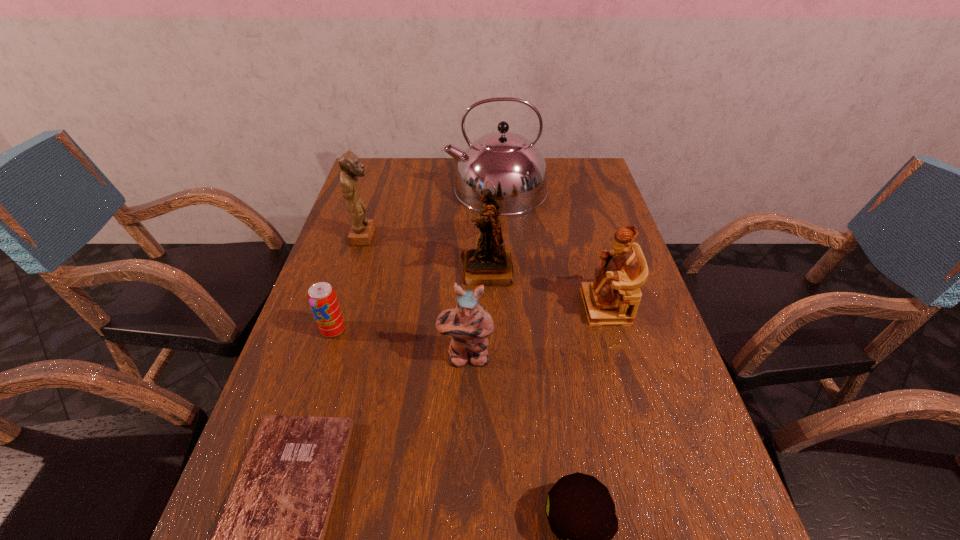
In the image, there is a desktop. Where is `vacant space at the left edge`? vacant space at the left edge is located at coordinates (353, 379).

Where is `vacant area at the right edge`? The width and height of the screenshot is (960, 540). vacant area at the right edge is located at coordinates (577, 212).

In the image, there is a desktop. At what (x,y) coordinates should I click in order to perform the action: click on vacant space at the far left corner. Please return your answer as a coordinate pair (x, y). Looking at the image, I should click on (378, 164).

The width and height of the screenshot is (960, 540). In the image, there is a desktop. Identify the location of vacant area at the far right corner. (607, 187).

Find the location of a particular element. vacant region between the third nearest object and the farthest figurine is located at coordinates (416, 297).

Find the location of a particular element. The width and height of the screenshot is (960, 540). free area in between the soda can and the second farthest object is located at coordinates (349, 284).

I want to click on vacant region between the third shortest object and the farthest figurine, so click(x=349, y=284).

This screenshot has width=960, height=540. Identify the location of the third closest object relative to the rightmost object. (516, 167).

At what (x,y) coordinates should I click in order to perform the action: click on object that ranks as the second closest to the leftmost figurine. Please return your answer as a coordinate pair (x, y). The height and width of the screenshot is (540, 960). Looking at the image, I should click on (490, 264).

Identify the location of figurine that stands as the third closest to the rightmost figurine. This screenshot has height=540, width=960. (362, 230).